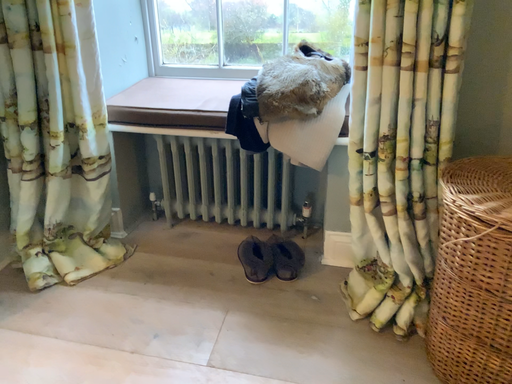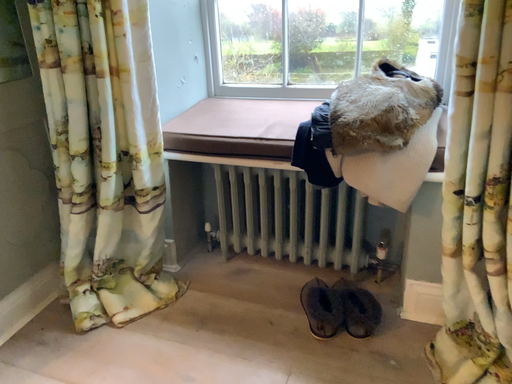
Question: Which way did the camera rotate in the video?

Choices:
 (A) rotated left
 (B) rotated right

Answer: (A)